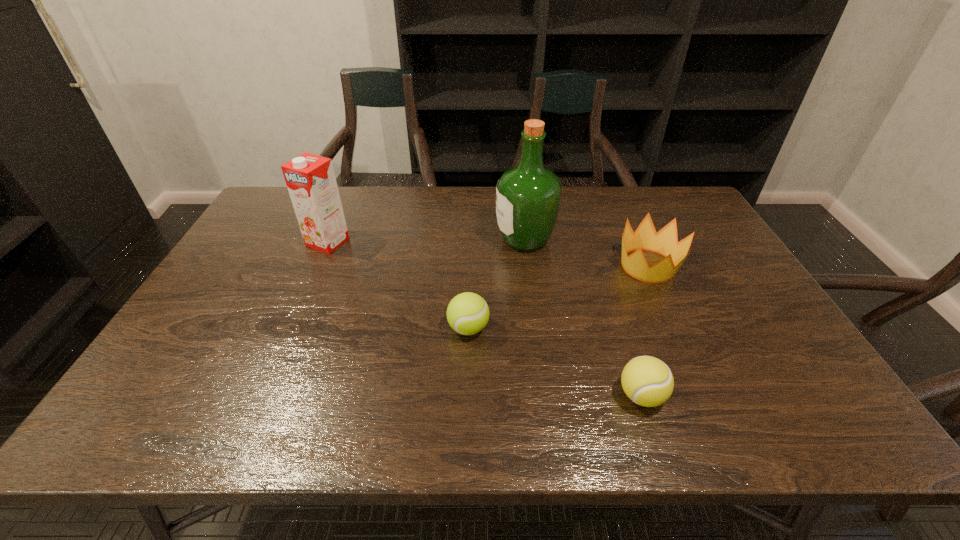
Where is `vacant area that lies between the third object from left to right and the crown`? vacant area that lies between the third object from left to right and the crown is located at coordinates (587, 253).

Locate an element on the screen. vacant area that lies between the nearer tennis ball and the left tennis ball is located at coordinates (555, 362).

The height and width of the screenshot is (540, 960). I want to click on vacant space that is in between the third object from right to left and the carton, so click(426, 241).

Point out which object is positioned as the nearest to the fourth farthest object. Please provide its 2D coordinates. Your answer should be formatted as a tuple, i.e. [(x, y)], where the tuple contains the x and y coordinates of a point satisfying the conditions above.

[(528, 196)]

Choose which object is the second nearest neighbor to the right tennis ball. Please provide its 2D coordinates. Your answer should be formatted as a tuple, i.e. [(x, y)], where the tuple contains the x and y coordinates of a point satisfying the conditions above.

[(665, 242)]

This screenshot has width=960, height=540. What are the coordinates of `vacant space that satisfies the following two spatial constraints: 1. on the back side of the crown; 2. on the front-facing side of the third object from left to right` in the screenshot? It's located at (636, 240).

Find the location of a particular element. The height and width of the screenshot is (540, 960). vacant space that satisfies the following two spatial constraints: 1. on the back side of the nearest object; 2. on the front-facing side of the third object from left to right is located at coordinates (591, 240).

This screenshot has width=960, height=540. Find the location of `free space that satisfies the following two spatial constraints: 1. on the back side of the nearer tennis ball; 2. on the front-facing side of the tallest object`. free space that satisfies the following two spatial constraints: 1. on the back side of the nearer tennis ball; 2. on the front-facing side of the tallest object is located at coordinates (591, 240).